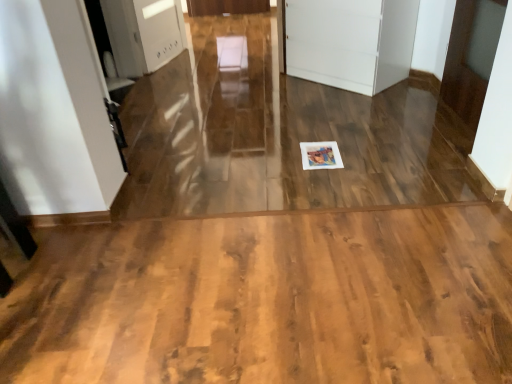
Question: In the image, is white glossy door at upper right, which ranks as the 2th door in left-to-right order, positioned in front of or behind white matte cabinet at center, which is the 2th door from right to left?

Choices:
 (A) front
 (B) behind

Answer: (A)

Question: From the image's perspective, is white glossy door at upper right, which is counted as the 1th door, starting from the right, positioned above or below white matte cabinet at center, acting as the first door starting from the left?

Choices:
 (A) below
 (B) above

Answer: (A)

Question: Based on their relative distances, which object is farther from the white glossy door at upper right, which is counted as the 1th door, starting from the right?

Choices:
 (A) wooden floor at center
 (B) white matte cabinet at center, which is the 2th door from right to left

Answer: (A)

Question: Estimate the real-world distances between objects in this image. Which object is closer to the white matte cabinet at center, acting as the first door starting from the left?

Choices:
 (A) wooden floor at center
 (B) white glossy door at upper right, which ranks as the 2th door in left-to-right order

Answer: (B)